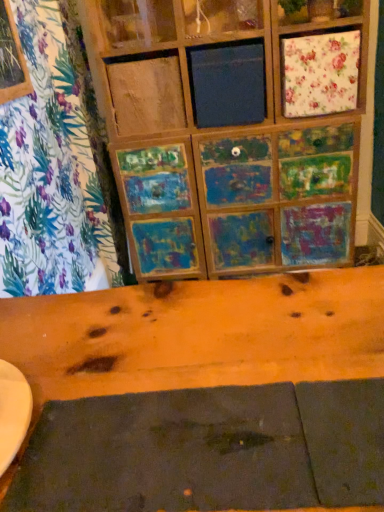
Question: Is dark matte placemat at lower center inside the boundaries of floral fabric cushion at upper right, or outside?

Choices:
 (A) outside
 (B) inside

Answer: (A)

Question: In the image, is dark matte placemat at lower center positioned in front of or behind floral fabric cushion at upper right?

Choices:
 (A) front
 (B) behind

Answer: (A)

Question: From the image's perspective, is dark matte placemat at lower center located above or below floral fabric cushion at upper right?

Choices:
 (A) below
 (B) above

Answer: (A)

Question: Considering the relative positions of floral fabric cushion at upper right and dark matte placemat at lower center in the image provided, is floral fabric cushion at upper right to the left or to the right of dark matte placemat at lower center?

Choices:
 (A) right
 (B) left

Answer: (A)

Question: Considering the positions of point (321, 79) and point (178, 460), is point (321, 79) closer or farther from the camera than point (178, 460)?

Choices:
 (A) closer
 (B) farther

Answer: (B)

Question: Looking at their shapes, would you say floral fabric cushion at upper right is wider or thinner than dark matte placemat at lower center?

Choices:
 (A) wide
 (B) thin

Answer: (B)

Question: From the image's perspective, is floral fabric cushion at upper right located above or below dark matte placemat at lower center?

Choices:
 (A) below
 (B) above

Answer: (B)